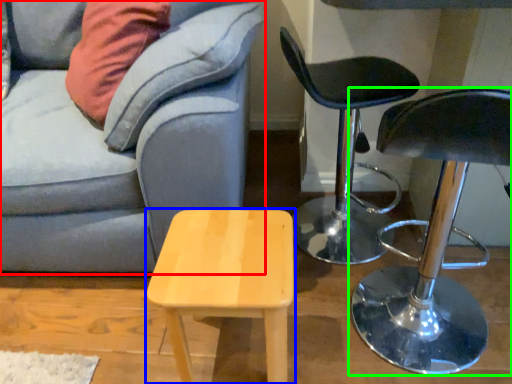
Question: Which is farther away from studio couch (highlighted by a red box)? stool (highlighted by a blue box) or chair (highlighted by a green box)?

Choices:
 (A) stool
 (B) chair

Answer: (B)